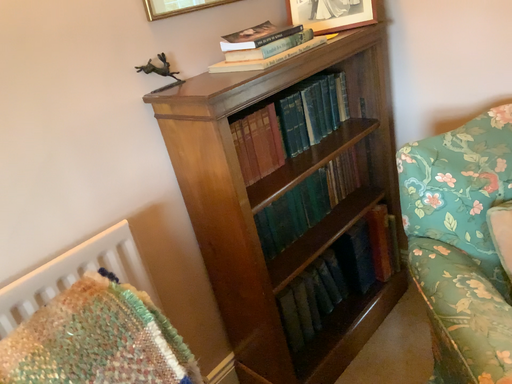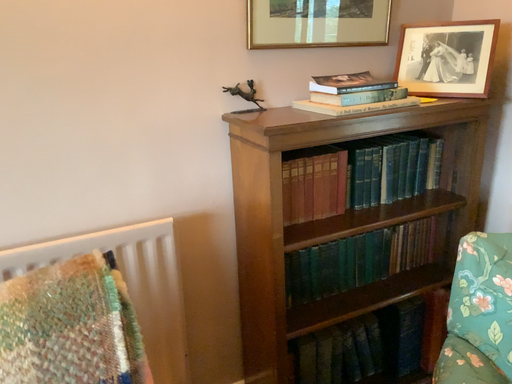
Question: How did the camera likely rotate when shooting the video?

Choices:
 (A) rotated upward
 (B) rotated downward

Answer: (A)